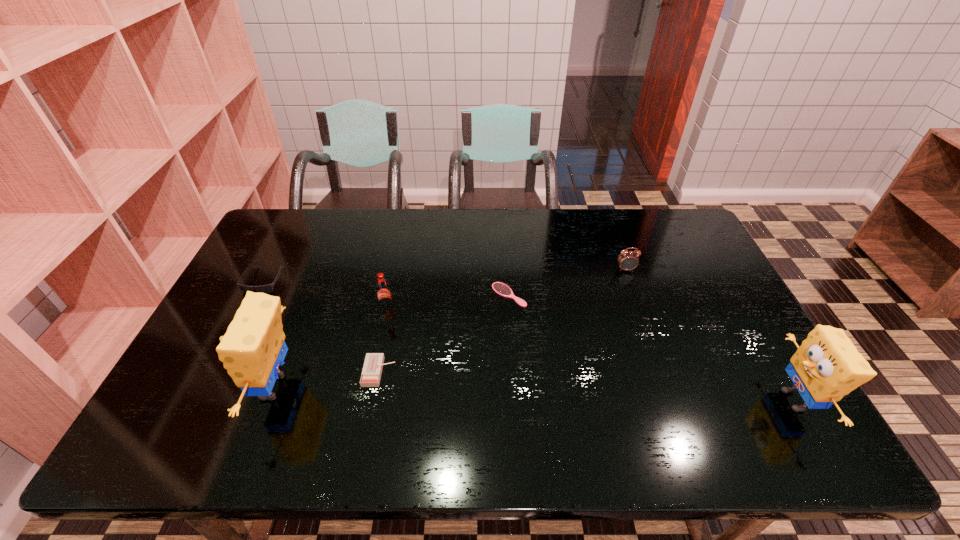
This screenshot has height=540, width=960. I want to click on the left sponge, so click(x=253, y=347).

Locate an element on the screen. the sixth object from right to left is located at coordinates (253, 347).

At what (x,y) coordinates should I click in order to perform the action: click on the rightmost object. Please return your answer as a coordinate pair (x, y). Image resolution: width=960 pixels, height=540 pixels. Looking at the image, I should click on click(827, 366).

In order to click on the right sponge in this screenshot , I will do `click(827, 366)`.

Where is `the sixth object from left to right`? the sixth object from left to right is located at coordinates (627, 260).

Find the location of a particular element. The width and height of the screenshot is (960, 540). the fourth tallest object is located at coordinates pyautogui.click(x=627, y=260).

Locate an element on the screen. The image size is (960, 540). sunglasses is located at coordinates (268, 288).

The image size is (960, 540). In order to click on the third shortest object in this screenshot , I will do `click(268, 288)`.

Where is `the shortest object`? The width and height of the screenshot is (960, 540). the shortest object is located at coordinates (500, 288).

Identify the location of the third object from right to left. The height and width of the screenshot is (540, 960). (500, 288).